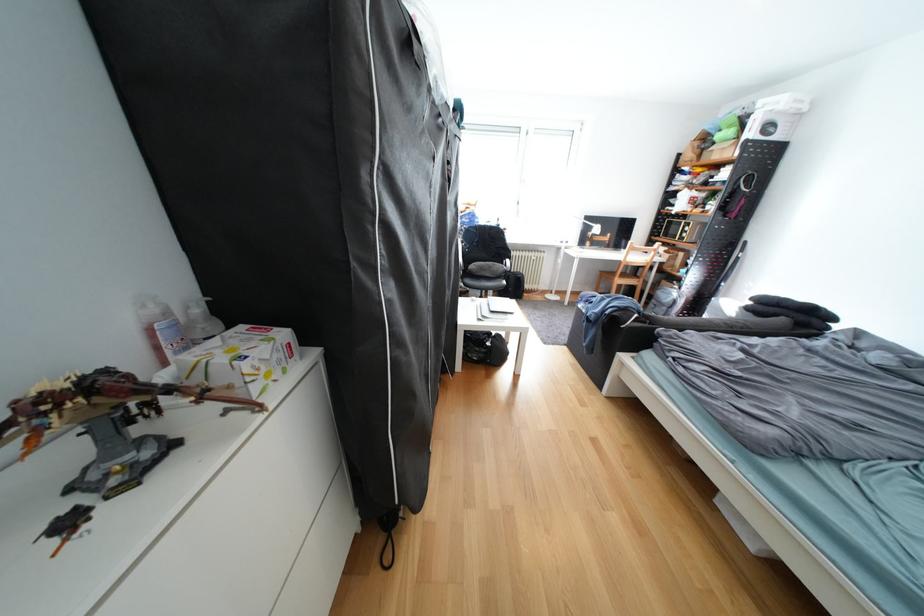
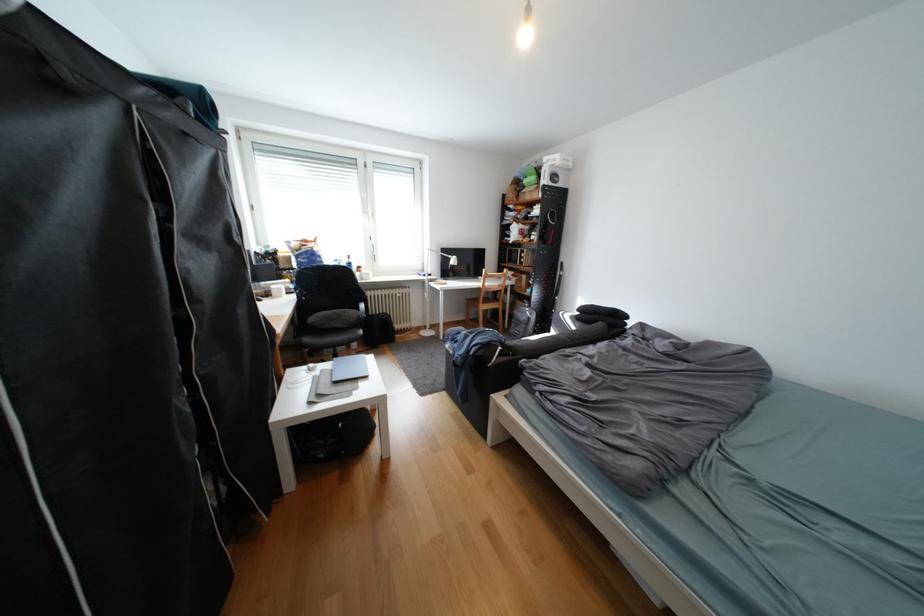
Question: The first image is from the beginning of the video and the second image is from the end. How did the camera likely rotate when shooting the video?

Choices:
 (A) Left
 (B) Right
 (C) Up
 (D) Down

Answer: (B)